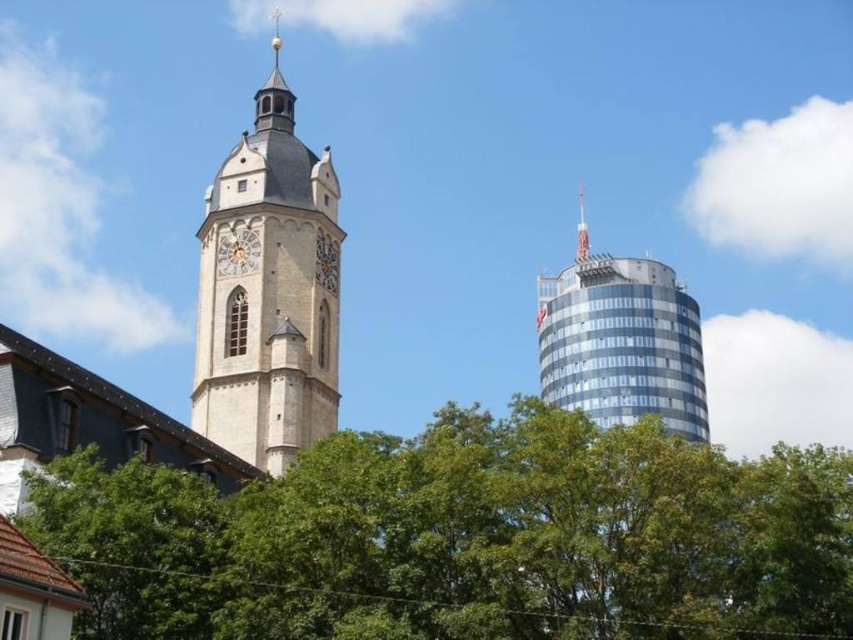
You are an architect evaluating the visual balance of the scene. Considering the blue glass skyscraper at right and the golden textured clock at center, which object would you say dominates the composition in terms of size?

The blue glass skyscraper at right has a larger size compared to the golden textured clock at center, so it dominates the composition in terms of size.

You are a city planner assessing the potential for a new pedestrian walkway between the blue glass skyscraper at right and the golden textured clock at center. Given that the walkway requires a minimum clearance of 200 feet between structures for safety, can the walkway be safely constructed?

The distance between the blue glass skyscraper at right and the golden textured clock at center is 225.07 feet, which exceeds the required 200 feet clearance. Therefore, the pedestrian walkway can be safely constructed between them.

You are standing at the point with coordinates (x=622, y=344). Looking at the image, which object is exactly at your position?

The blue glass skyscraper at right is located at point (x=622, y=344).